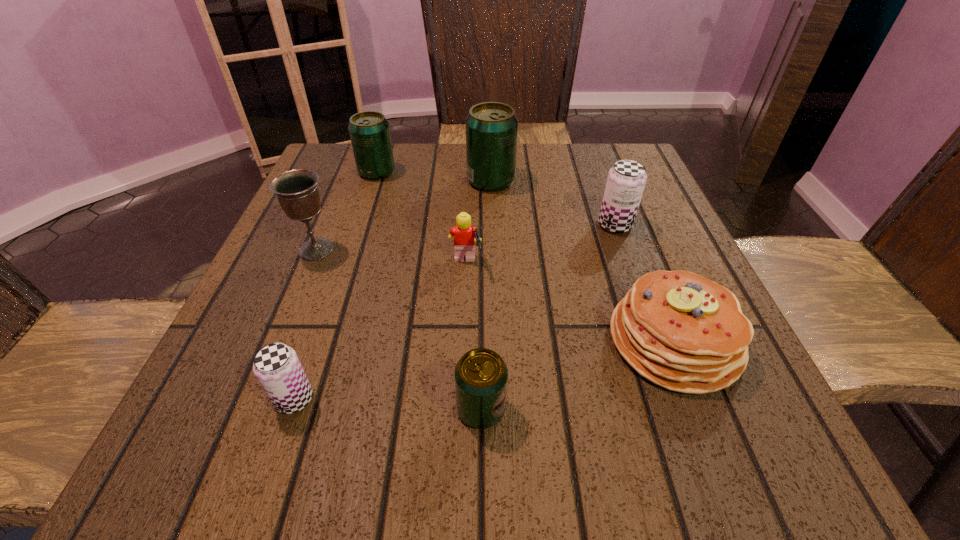
At what (x,y) coordinates should I click in order to perform the action: click on beer can that is the closest to the Lego. Please return your answer as a coordinate pair (x, y). Looking at the image, I should click on (491, 127).

This screenshot has height=540, width=960. In order to click on beer can that stands as the closest to the tallest beer can in this screenshot , I will do `click(369, 131)`.

Where is `green beer can object that ranks as the second closest to the leftmost green beer can`? The width and height of the screenshot is (960, 540). green beer can object that ranks as the second closest to the leftmost green beer can is located at coordinates (481, 375).

At what (x,y) coordinates should I click in order to perform the action: click on the closest green beer can to the pancake. Please return your answer as a coordinate pair (x, y). The height and width of the screenshot is (540, 960). Looking at the image, I should click on (481, 375).

Find the location of a particular element. This screenshot has height=540, width=960. vacant space that satisfies the following two spatial constraints: 1. on the back side of the biggest green beer can; 2. on the left side of the left purple beer can is located at coordinates (369, 181).

Find the location of a particular element. The height and width of the screenshot is (540, 960). vacant space that satisfies the following two spatial constraints: 1. on the front side of the tallest beer can; 2. on the left side of the pancake is located at coordinates (496, 341).

Image resolution: width=960 pixels, height=540 pixels. I want to click on vacant area in the image that satisfies the following two spatial constraints: 1. on the front side of the left purple beer can; 2. on the right side of the nearest green beer can, so click(291, 409).